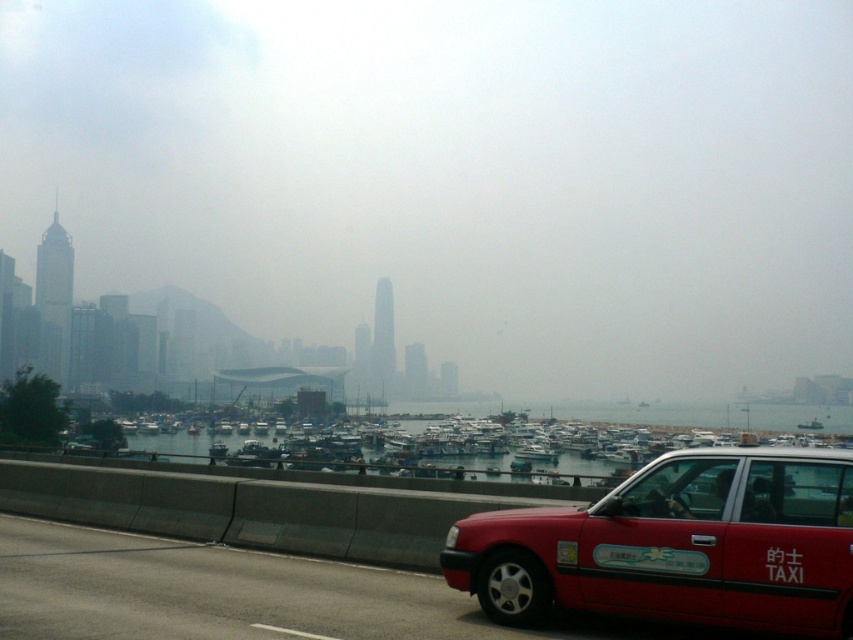
Question: Does foggy haze at center appear on the right side of matte red taxi at lower right?

Choices:
 (A) yes
 (B) no

Answer: (B)

Question: Which point is closer to the camera?

Choices:
 (A) (663, 579)
 (B) (788, 228)

Answer: (A)

Question: Does foggy haze at center have a greater width compared to matte red taxi at lower right?

Choices:
 (A) yes
 (B) no

Answer: (A)

Question: Is foggy haze at center wider than matte red taxi at lower right?

Choices:
 (A) no
 (B) yes

Answer: (B)

Question: Which point is farther to the camera?

Choices:
 (A) (618, 605)
 (B) (541, 241)

Answer: (B)